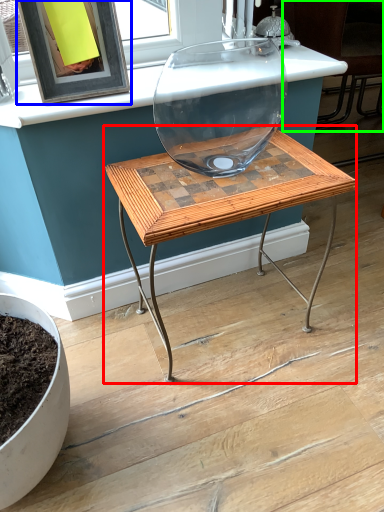
Question: Estimate the real-world distances between objects in this image. Which object is closer to table (highlighted by a red box), picture frame (highlighted by a blue box) or chair (highlighted by a green box)?

Choices:
 (A) picture frame
 (B) chair

Answer: (A)